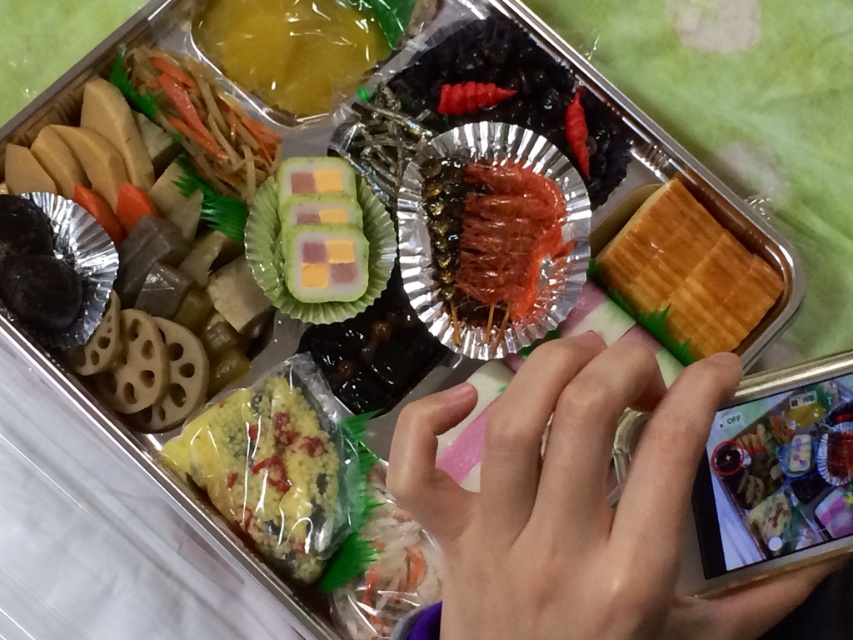
You are a food critic examining the bento box. You notice two items at the center of the bento box. What is the relationship between the pale skin at center and the yellow rice at center?

The pale skin at center is positioned over the yellow rice at center.